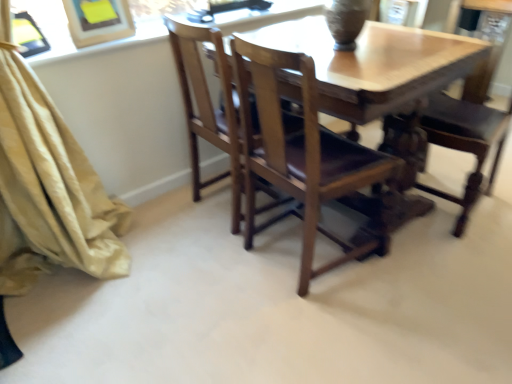
Where is `free space in front of beige fabric curtain at left`? The image size is (512, 384). free space in front of beige fabric curtain at left is located at coordinates (94, 332).